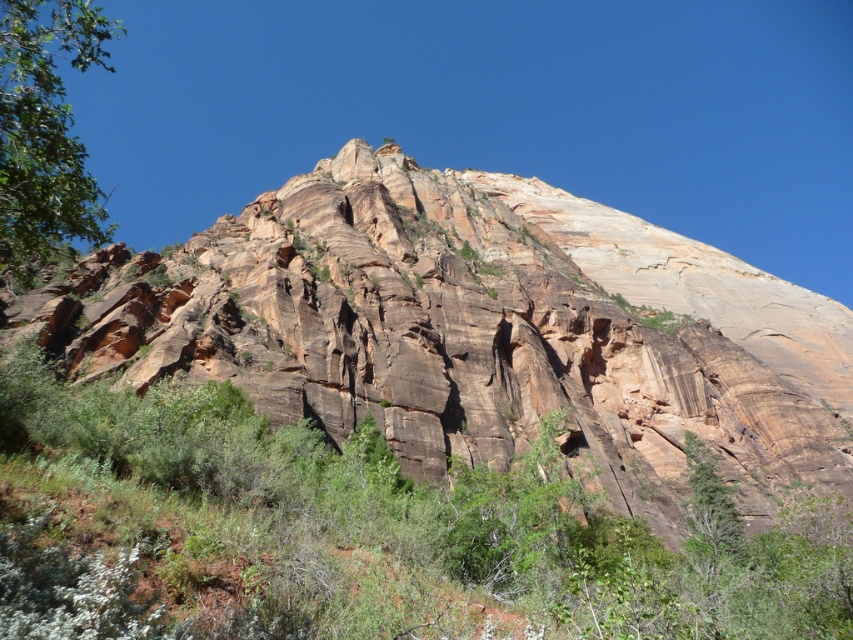
You are standing at the base of the rustic rock cliff at center and want to reach the green leafy tree at left. Which direction should you move to get there?

To reach the green leafy tree at left from the rustic rock cliff at center, you should move to the left since the rustic rock cliff at center is to the right of the green leafy tree at left.

You are a photographer standing at the base of the rock formation. You want to take a photo that includes both the point at coordinates point (447, 362) and point (253, 586). Which point is closer to your camera lens when you take the photo?

Point (253, 586) is closer to the camera lens because the description states that point (447, 362) is further to the camera than point (253, 586).

You are a hiker standing at the base of the rustic rock cliff at center and the green leafy tree at left. Which object is taller?

The green leafy tree at left is taller than the rustic rock cliff at center.